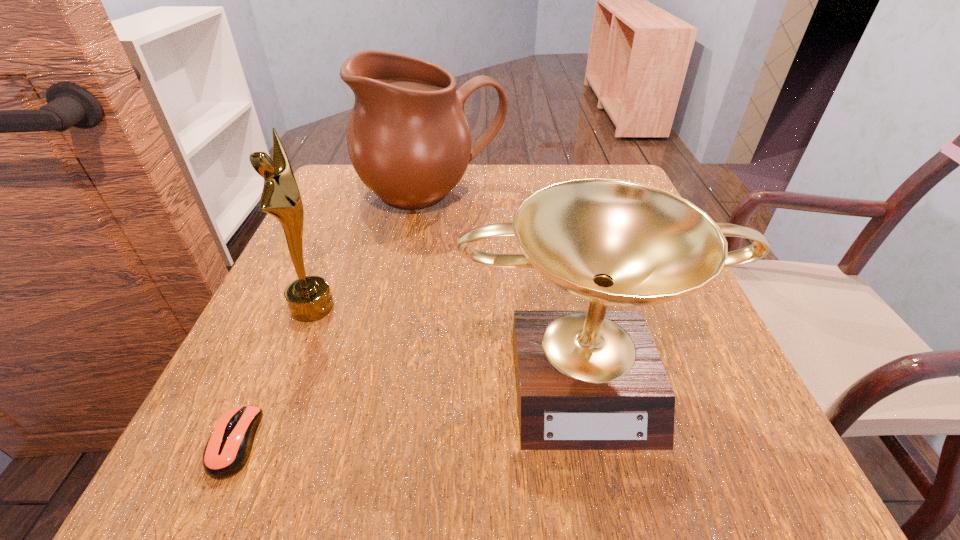
You are a GUI agent. You are given a task and a screenshot of the screen. Output one action in this format:
    pyautogui.click(x=<x>, y=<y>)
    Task: Click on the computer mouse that is at the near edge
    
    Given the screenshot: What is the action you would take?
    pyautogui.click(x=228, y=448)

Image resolution: width=960 pixels, height=540 pixels. Find the location of `cream pitcher that is at the left edge`. cream pitcher that is at the left edge is located at coordinates (408, 139).

Locate an element on the screen. The width and height of the screenshot is (960, 540). award located at the left edge is located at coordinates (309, 298).

The image size is (960, 540). Find the location of `computer mouse located in the left edge section of the desktop`. computer mouse located in the left edge section of the desktop is located at coordinates (228, 448).

Locate an element on the screen. object that is at the right edge is located at coordinates (585, 380).

The width and height of the screenshot is (960, 540). Identify the location of object present at the far left corner. (408, 139).

Locate an element on the screen. The image size is (960, 540). object situated at the near left corner is located at coordinates (228, 448).

Identify the location of object that is at the near right corner. The height and width of the screenshot is (540, 960). 585,380.

Find the location of a particular element. This screenshot has width=960, height=540. vacant space at the far edge of the desktop is located at coordinates (485, 186).

This screenshot has height=540, width=960. In order to click on vacant space at the near edge of the desktop in this screenshot , I will do `click(514, 438)`.